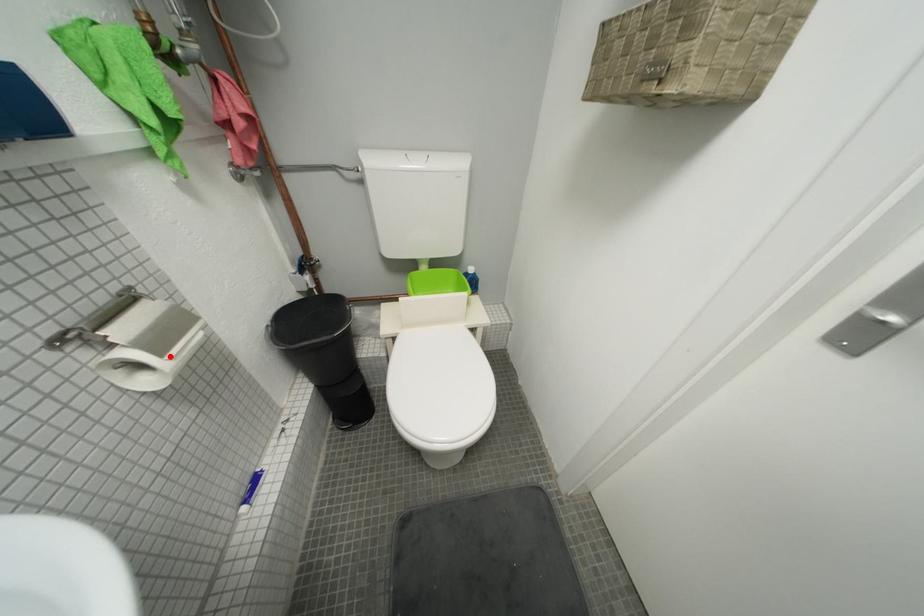
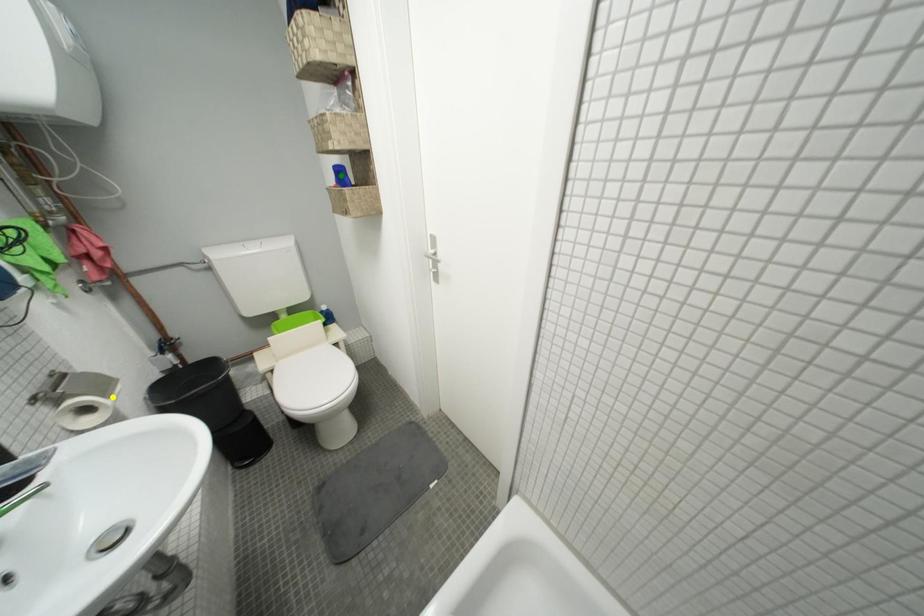
Question: I am providing you with two images of the same scene from different viewpoints. A red point is marked on the first image. You are given multiple points on the second image. Can you choose the point in image 2 that corresponds to the point in image 1?

Choices:
 (A) yellow point
 (B) blue point
 (C) green point

Answer: (A)